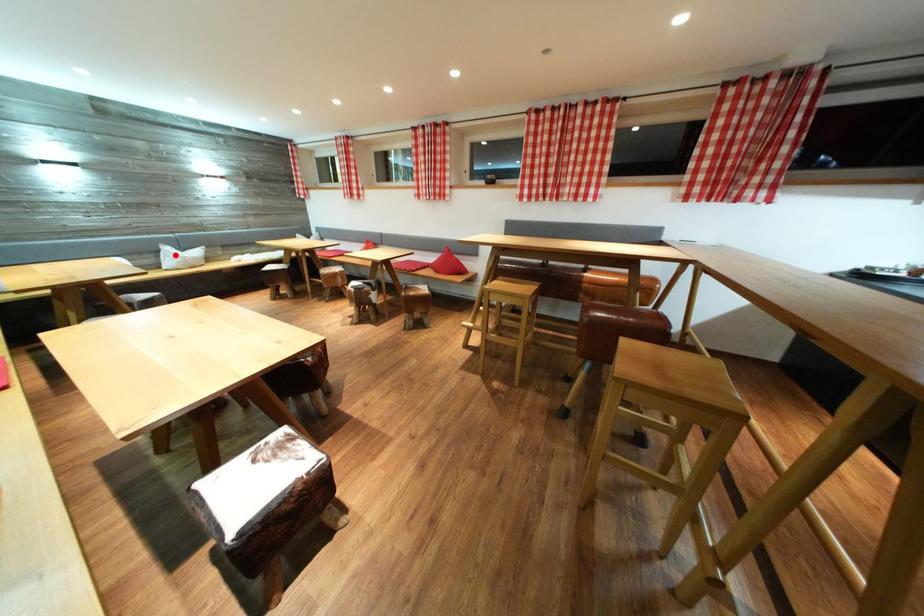
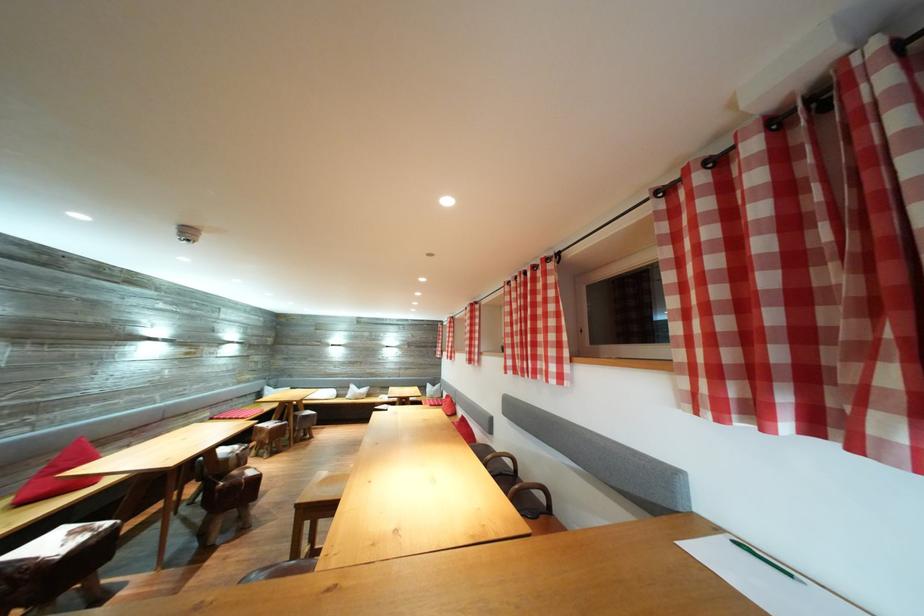
Find the pixel in the second image that matches the highlighted location in the first image.

(359, 392)